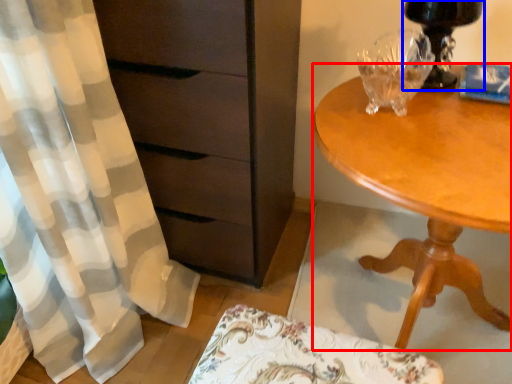
Question: Which object appears farthest to the camera in this image, desk (highlighted by a red box) or table lamp (highlighted by a blue box)?

Choices:
 (A) desk
 (B) table lamp

Answer: (B)